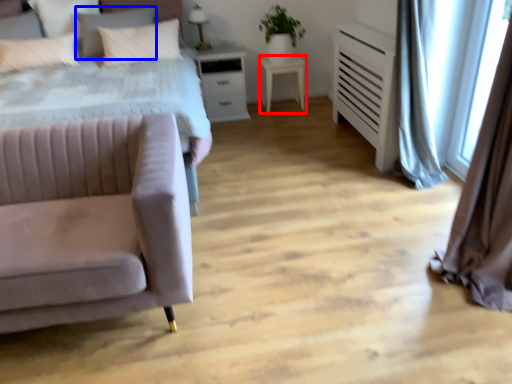
Question: Which of the following is the farthest to the observer, table (highlighted by a red box) or pillow (highlighted by a blue box)?

Choices:
 (A) table
 (B) pillow

Answer: (A)